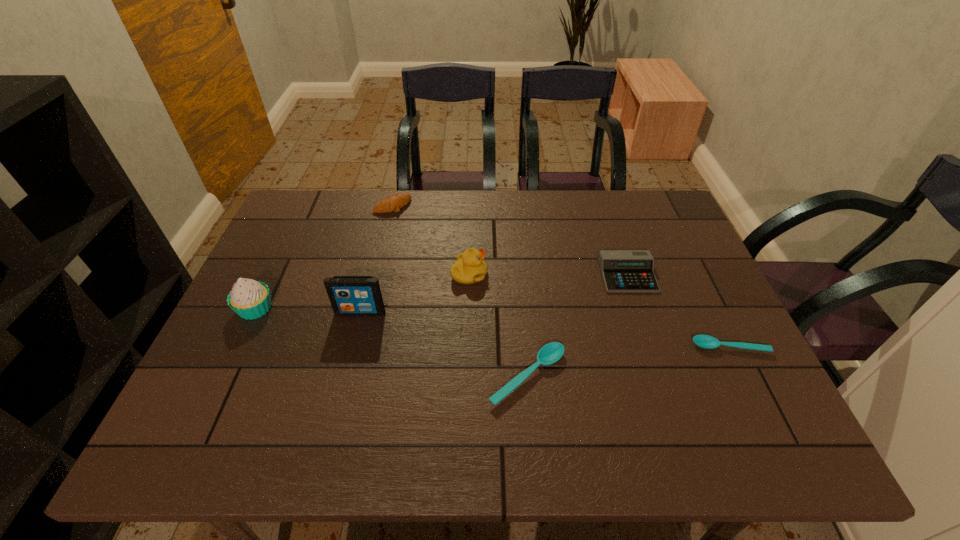
Observe the arrangement of all spoons in the image. To keep them evenly spaced, where would you place another spoon on the left? Please locate a free space. Please provide its 2D coordinates. Your answer should be formatted as a tuple, i.e. [(x, y)], where the tuple contains the x and y coordinates of a point satisfying the conditions above.

[(300, 410)]